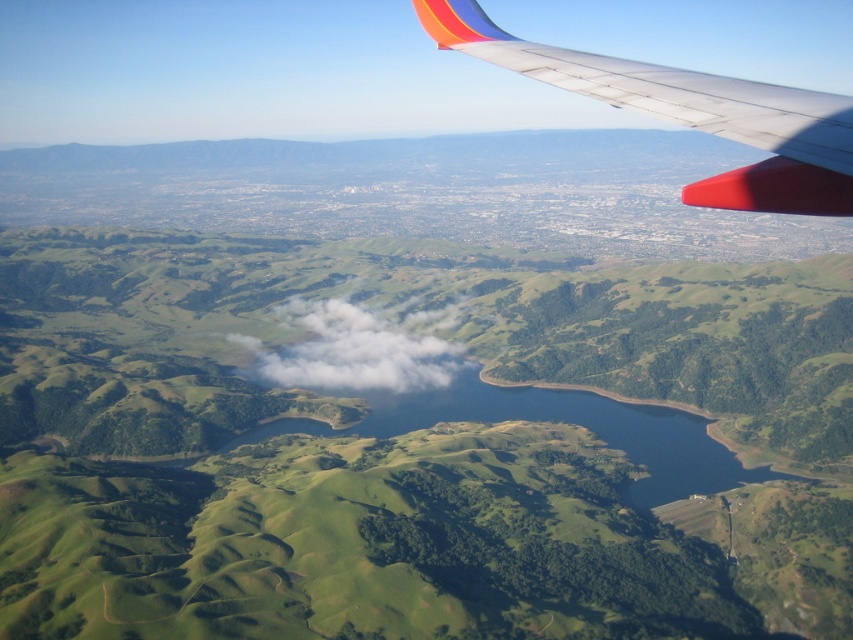
You are a passenger looking out of the airplane window. You see the metallic silver wing at upper right and the white fluffy cloud at center. Which object takes up more space in your view?

The white fluffy cloud at center takes up more space than the metallic silver wing at upper right.

As an airplane passenger, you notice the green grassy hills at center and the metallic silver wing at upper right through the window. Which of these two objects is positioned to the left side from your perspective?

The green grassy hills at center are to the left of the metallic silver wing at upper right, so the green grassy hills at center is positioned to the left side from your perspective.

You are a passenger looking out the airplane window. You see the green grassy hills at center and the white fluffy cloud at center. Which one is closer to you?

The green grassy hills at center are closer to the viewer than the white fluffy cloud at center.